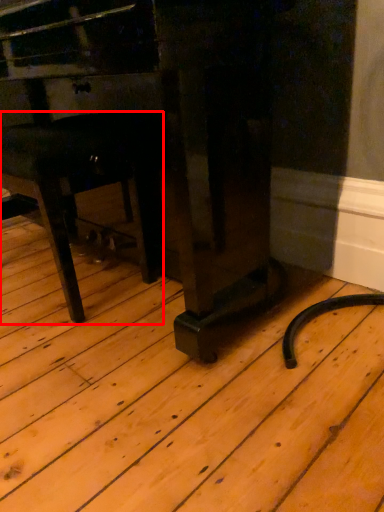
Question: In this image, where is furniture (annotated by the red box) located relative to furniture?

Choices:
 (A) right
 (B) left

Answer: (B)